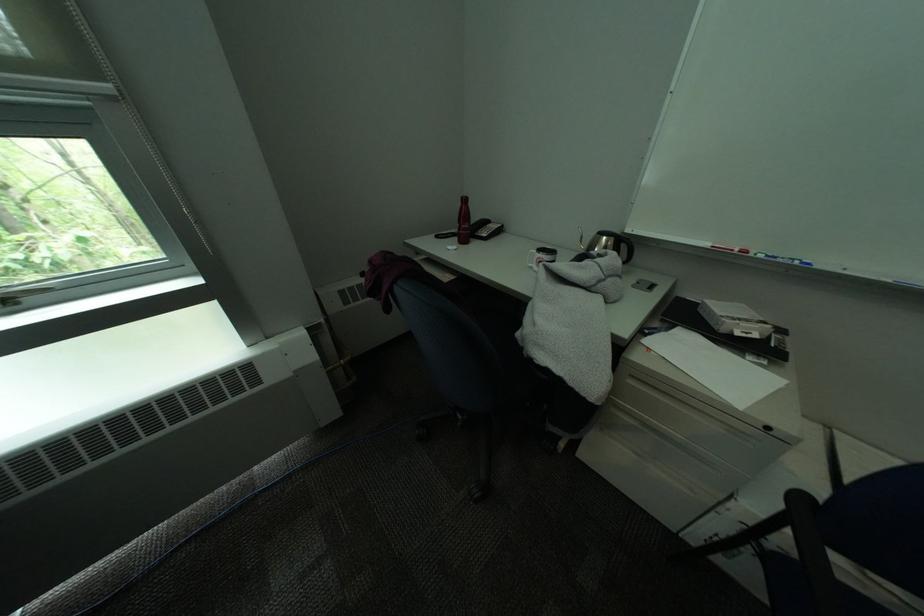
Identify the location of chair sitting surface. (505, 341).